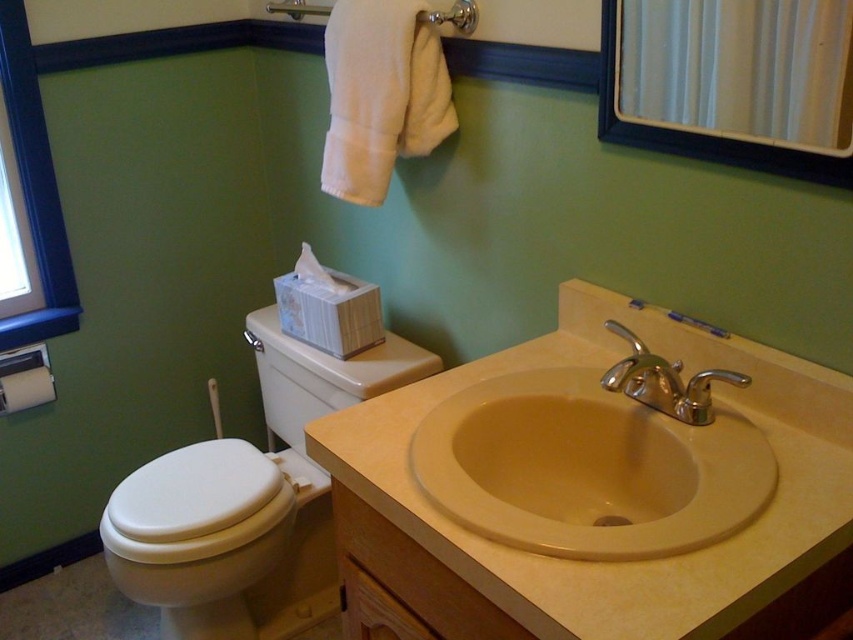
You are a home inspector assessing bathroom layout compliance. The building code requires that the white glossy toilet bowl at left must not be placed directly in front of the metallic silver mirror at upper right. Based on the scene, is this bathroom compliant?

The white glossy toilet bowl at left is positioned on the left side of the metallic silver mirror at upper right, so it is not directly in front of it. Therefore, the bathroom is compliant with the building code.

You are standing in the bathroom and want to wash your hands. Where is the beige ceramic sink at center located?

The beige ceramic sink at center is located at point 0.733 on the x axis and 0.689 on the y axis.

You are standing in the bathroom and want to locate the metallic silver mirror at upper right. According to the scene description, where would you find it?

The metallic silver mirror at upper right is located at point (735,68).